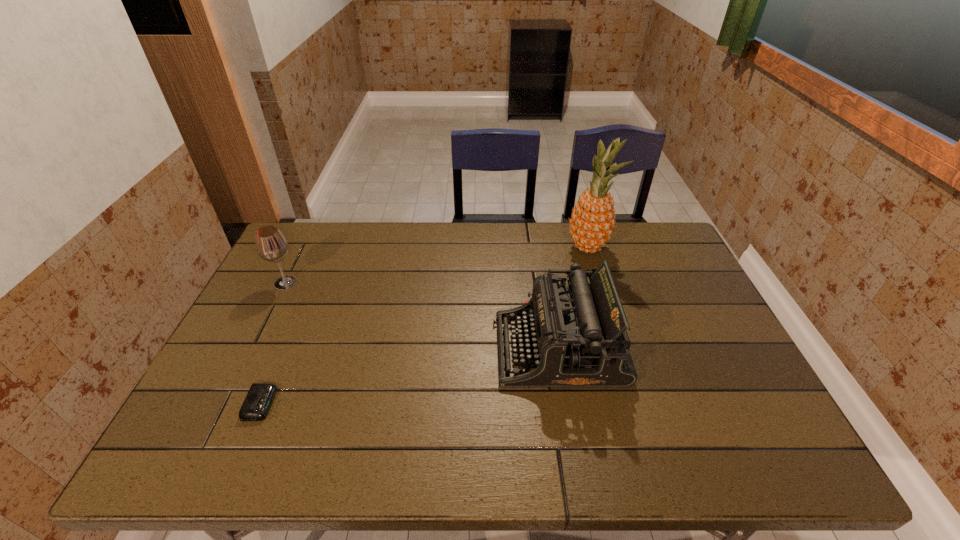
Image resolution: width=960 pixels, height=540 pixels. I want to click on pineapple, so click(x=592, y=222).

You are a GUI agent. You are given a task and a screenshot of the screen. Output one action in this format:
    pyautogui.click(x=<x>, y=<y>)
    Task: Click on the tallest object
    
    Given the screenshot: What is the action you would take?
    pyautogui.click(x=592, y=222)

Locate an element on the screen. This screenshot has width=960, height=540. typewriter is located at coordinates (577, 337).

This screenshot has width=960, height=540. Find the location of `wineglass`. wineglass is located at coordinates (271, 245).

Where is `the second farthest object`? Image resolution: width=960 pixels, height=540 pixels. the second farthest object is located at coordinates (271, 245).

The height and width of the screenshot is (540, 960). Find the location of `alarm clock`. alarm clock is located at coordinates (259, 398).

You are a GUI agent. You are given a task and a screenshot of the screen. Output one action in this format:
    pyautogui.click(x=<x>, y=<y>)
    Task: Click on the third object from right to left
    
    Given the screenshot: What is the action you would take?
    pyautogui.click(x=259, y=398)

Locate an element on the screen. The width and height of the screenshot is (960, 540). vacant region located 0.160m on the front of the farthest object is located at coordinates (602, 295).

The image size is (960, 540). I want to click on vacant area situated 0.080m on the keyboard of the typewriter, so click(464, 349).

You are a GUI agent. You are given a task and a screenshot of the screen. Output one action in this format:
    pyautogui.click(x=<x>, y=<y>)
    Task: Click on the free space located 0.280m on the keyboard of the typewriter
    The height and width of the screenshot is (540, 960).
    Given the screenshot: What is the action you would take?
    [388, 349]